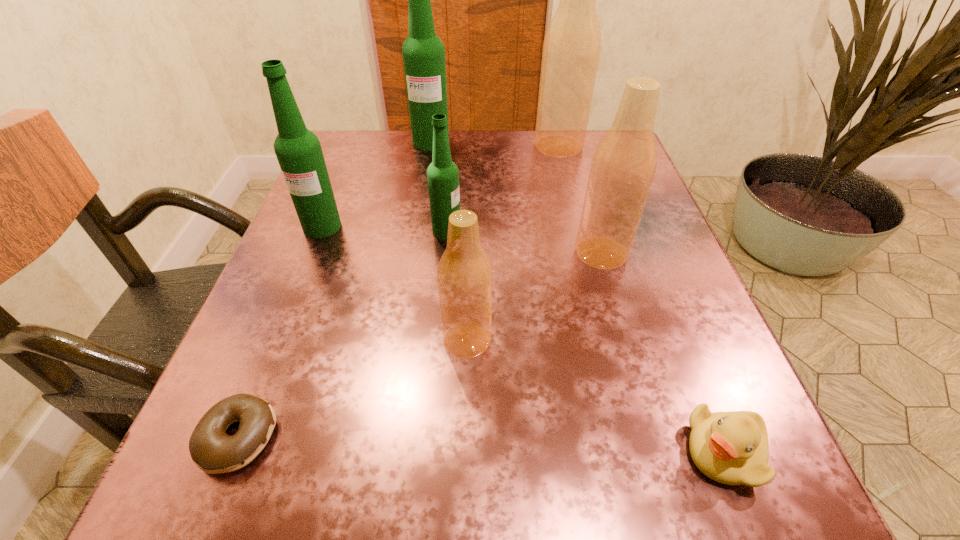
What are the coordinates of `the farthest green beer bottle` in the screenshot? It's located at (423, 52).

Find the location of `the farthest tan beer bottle`. the farthest tan beer bottle is located at coordinates (572, 44).

This screenshot has width=960, height=540. What are the coordinates of `the second biggest tan beer bottle` in the screenshot? It's located at (624, 163).

You are a GUI agent. You are given a task and a screenshot of the screen. Output one action in this format:
    pyautogui.click(x=<x>, y=<y>)
    Task: Click on the leftmost green beer bottle
    The height and width of the screenshot is (540, 960).
    Given the screenshot: What is the action you would take?
    [298, 150]

Image resolution: width=960 pixels, height=540 pixels. I want to click on the second biggest green beer bottle, so [x=298, y=150].

The width and height of the screenshot is (960, 540). In order to click on the smallest green beer bottle in this screenshot , I will do `click(442, 174)`.

The width and height of the screenshot is (960, 540). In order to click on the smallest tan beer bottle in this screenshot , I will do `click(464, 275)`.

Where is `the leftmost tan beer bottle`? This screenshot has width=960, height=540. the leftmost tan beer bottle is located at coordinates (464, 275).

Find the location of `duckling`. duckling is located at coordinates (731, 448).

Find the location of a particular element. yellow duckling is located at coordinates (731, 448).